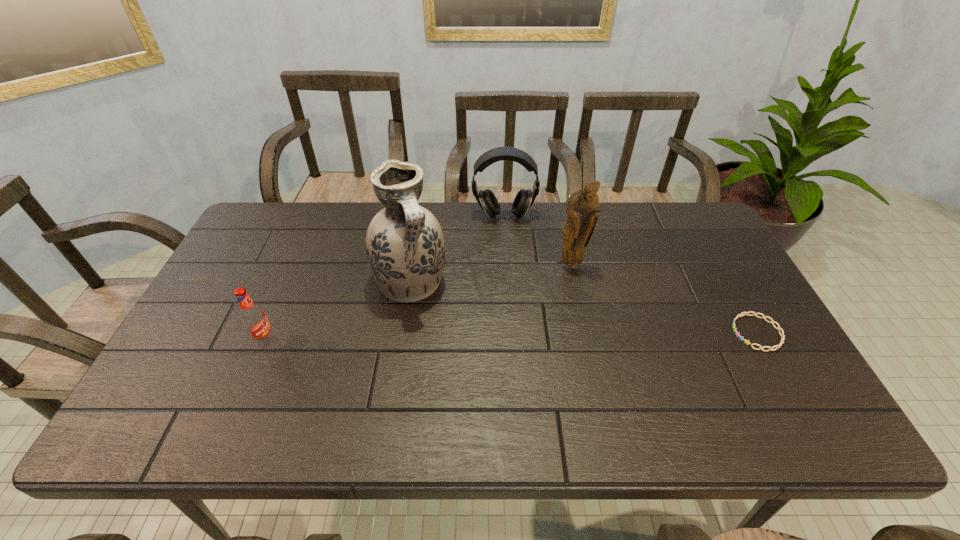
Find the location of a particular element. This screenshot has height=540, width=960. vacant space that satisfies the following two spatial constraints: 1. on the back side of the leftmost object; 2. on the right side of the fourth object from right to left is located at coordinates (290, 283).

Find the location of a particular element. free space that satisfies the following two spatial constraints: 1. on the back side of the fourth object from left to right; 2. on the right side of the root beer is located at coordinates (297, 266).

The image size is (960, 540). What are the coordinates of `vacant space that satisfies the following two spatial constraints: 1. on the front side of the shortest object; 2. on the surface of the tallest object showing star-shaped elements` in the screenshot? It's located at (403, 333).